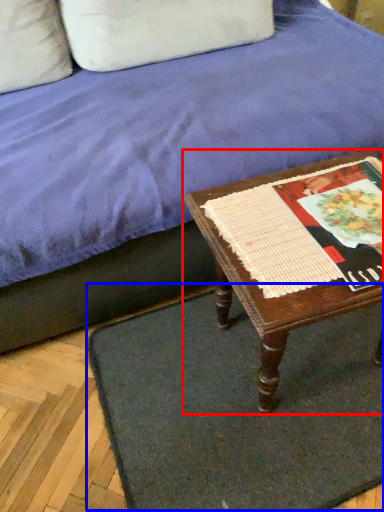
Question: Which point is closer to the camera, table (highlighted by a red box) or doormat (highlighted by a blue box)?

Choices:
 (A) table
 (B) doormat

Answer: (A)